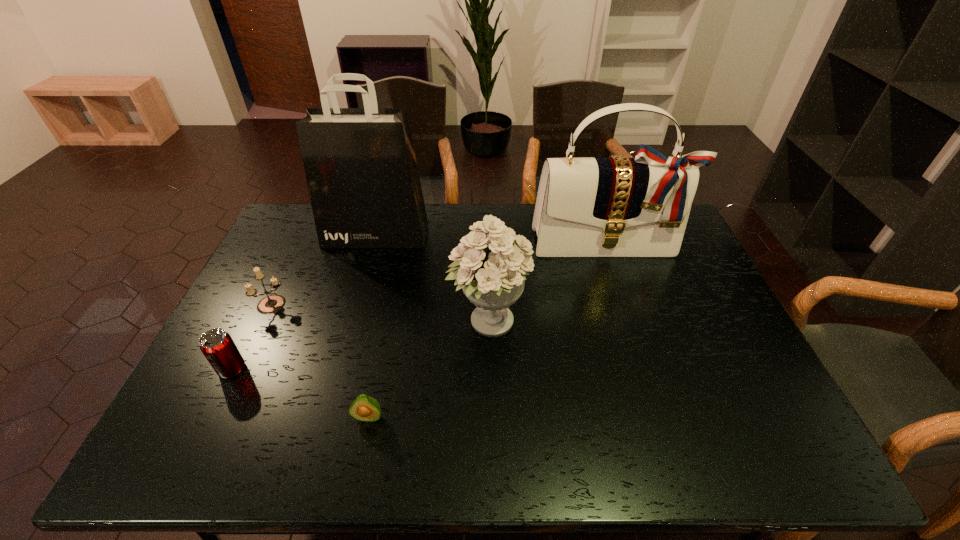
This screenshot has height=540, width=960. What are the coordinates of `vacant area between the fifth object from left to right and the avocado` in the screenshot? It's located at pos(428,369).

Locate an element on the screen. Image resolution: width=960 pixels, height=540 pixels. free spot between the second object from right to left and the avocado is located at coordinates (428, 369).

Locate an element on the screen. object that is the second closest to the soda can is located at coordinates (364, 408).

This screenshot has width=960, height=540. I want to click on object that is the fifth closest to the candle holder, so click(618, 206).